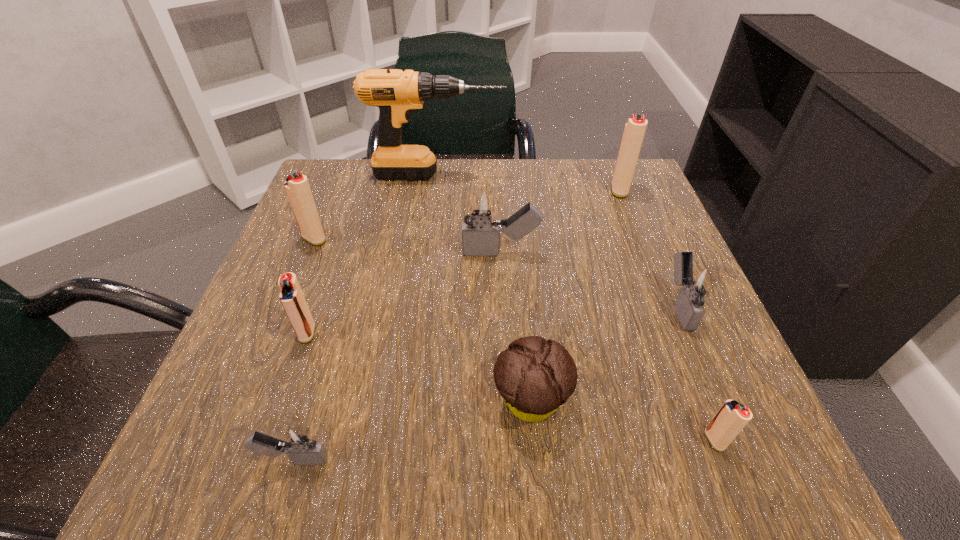
The height and width of the screenshot is (540, 960). I want to click on the second red igniter from left to right, so pos(291,296).

Identify the location of chocolate muffin. The width and height of the screenshot is (960, 540). (535, 377).

What are the coordinates of `the smallest red igniter` in the screenshot? It's located at (732, 417).

Where is `the nearest gray igniter`? This screenshot has height=540, width=960. the nearest gray igniter is located at coordinates (297, 441).

This screenshot has height=540, width=960. Identify the location of the leftmost gray igniter. (297, 441).

Where is `blank space located 0.230m at the tip of the drill`? Image resolution: width=960 pixels, height=540 pixels. blank space located 0.230m at the tip of the drill is located at coordinates (600, 175).

The width and height of the screenshot is (960, 540). What are the coordinates of `vacant region located 0.250m on the left of the farthest red igniter` in the screenshot? It's located at (499, 190).

The image size is (960, 540). Identify the location of vacant position located 0.270m on the right of the leftmost red igniter. (464, 239).

The image size is (960, 540). I want to click on vacant space located 0.380m on the front of the fourth igniter from right to left, so click(512, 477).

You are a GUI agent. You are given a task and a screenshot of the screen. Output one action in this format:
    pyautogui.click(x=<x>, y=<y>)
    Task: Click on the vacant space located on the left of the rightmost gray igniter
    The width and height of the screenshot is (960, 540).
    Given the screenshot: What is the action you would take?
    pyautogui.click(x=472, y=306)